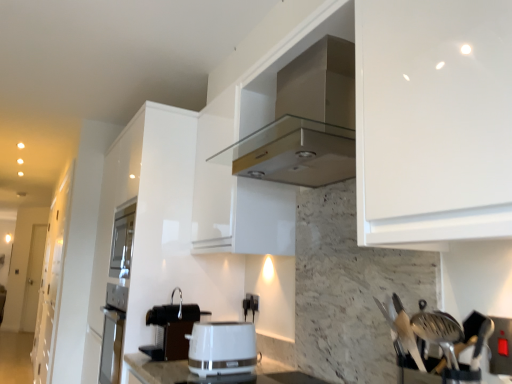
Question: Considering the relative sizes of white glossy toaster at center and black plastic electric outlet at center in the image provided, is white glossy toaster at center taller than black plastic electric outlet at center?

Choices:
 (A) no
 (B) yes

Answer: (B)

Question: Is white glossy toaster at center aimed at black plastic electric outlet at center?

Choices:
 (A) no
 (B) yes

Answer: (A)

Question: From a real-world perspective, does white glossy toaster at center sit lower than black plastic electric outlet at center?

Choices:
 (A) no
 (B) yes

Answer: (B)

Question: From the image's perspective, is white glossy toaster at center under black plastic electric outlet at center?

Choices:
 (A) yes
 (B) no

Answer: (A)

Question: Is the position of white glossy toaster at center more distant than that of black plastic electric outlet at center?

Choices:
 (A) yes
 (B) no

Answer: (B)

Question: Is white glossy toaster at center not inside black plastic electric outlet at center?

Choices:
 (A) no
 (B) yes

Answer: (B)

Question: Is metallic silver utensils at right positioned in front of white glossy toaster at center?

Choices:
 (A) no
 (B) yes

Answer: (B)

Question: Is white glossy toaster at center a part of metallic silver utensils at right?

Choices:
 (A) no
 (B) yes

Answer: (A)

Question: Can we say metallic silver utensils at right lies outside white glossy toaster at center?

Choices:
 (A) yes
 (B) no

Answer: (A)

Question: Is metallic silver utensils at right positioned far away from white glossy toaster at center?

Choices:
 (A) no
 (B) yes

Answer: (A)

Question: From a real-world perspective, is metallic silver utensils at right below white glossy toaster at center?

Choices:
 (A) no
 (B) yes

Answer: (A)

Question: Is metallic silver utensils at right wider than white glossy toaster at center?

Choices:
 (A) yes
 (B) no

Answer: (B)

Question: Is black plastic coffee machine at lower center positioned far away from white glossy cabinet at left?

Choices:
 (A) yes
 (B) no

Answer: (A)